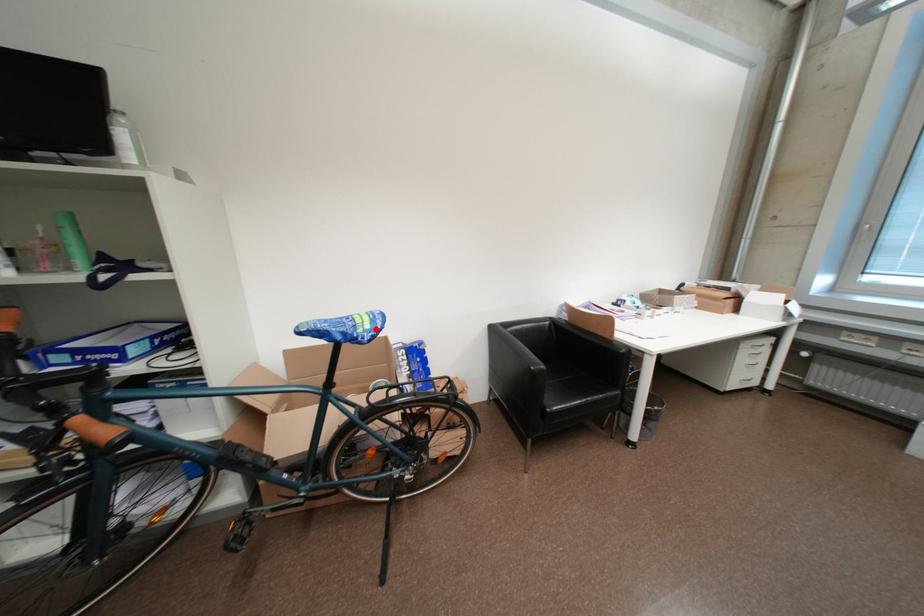
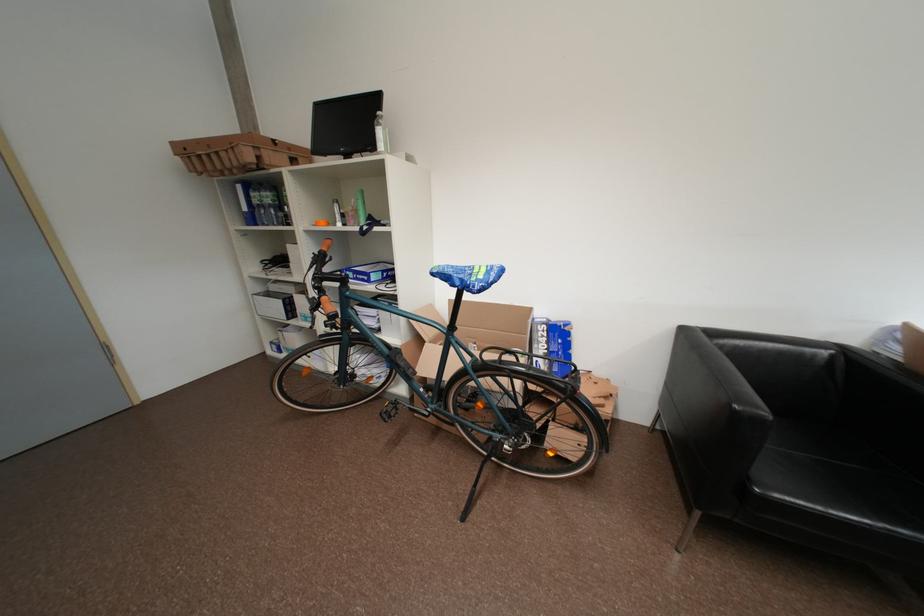
In the second image, find the point that corresponds to the highlighted location in the first image.

(489, 278)